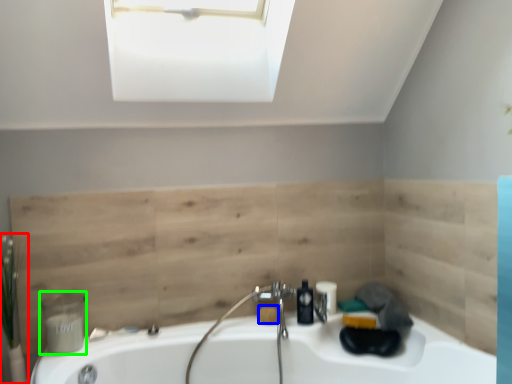
Question: Estimate the real-world distances between objects in this image. Which object is farther from plant (highlighted by a red box), soap (highlighted by a blue box) or toiletry (highlighted by a green box)?

Choices:
 (A) soap
 (B) toiletry

Answer: (A)